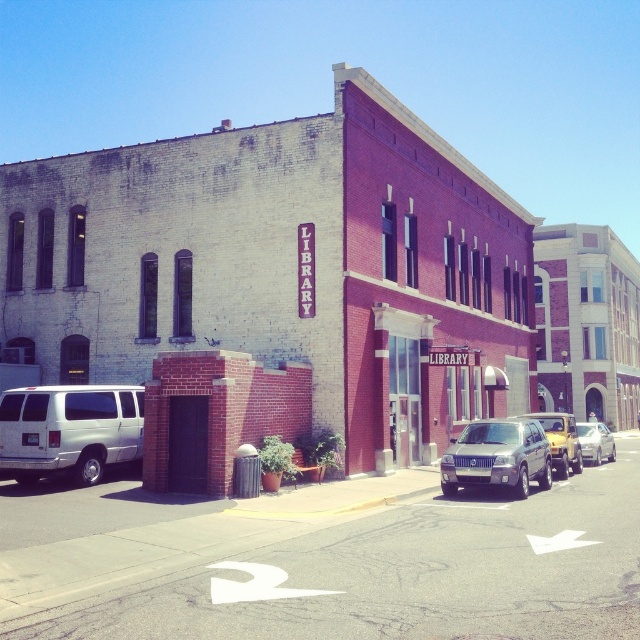
You are a delivery person standing at the entrance of the building. You need to park your satin silver suv at center in a spot that is 1.5 meters away from the curb. Can you park it there based on its current position?

The satin silver suv at center is located at point coordinates which may be close enough to the curb, but since the exact distance isn

You are standing on the sidewalk in front of the building and want to reach the point marked at coordinate [561,324]. Given that the distance from your current position to the building is 100 feet, can you safely walk to that point without crossing the yellow curb?

The point marked at coordinate [561,324] is 200.73 feet away from the camera. Since you are currently 100 feet away from the building, the distance between you and the point is greater than 100 feet. Therefore, you would need to walk past the building to reach it, which means crossing the yellow curb is necessary. However, it is not safe to cross the curb as it is painted yellow, typically indicating a no stopping or crossing zone.

Consider the image. You are a pedestrian standing on the sidewalk in front of the two sections of the building. You see the satin silver suv at center and the metallic silver sedan at center. Which vehicle is closer to you?

The satin silver suv at center is closer to you than the metallic silver sedan at center.